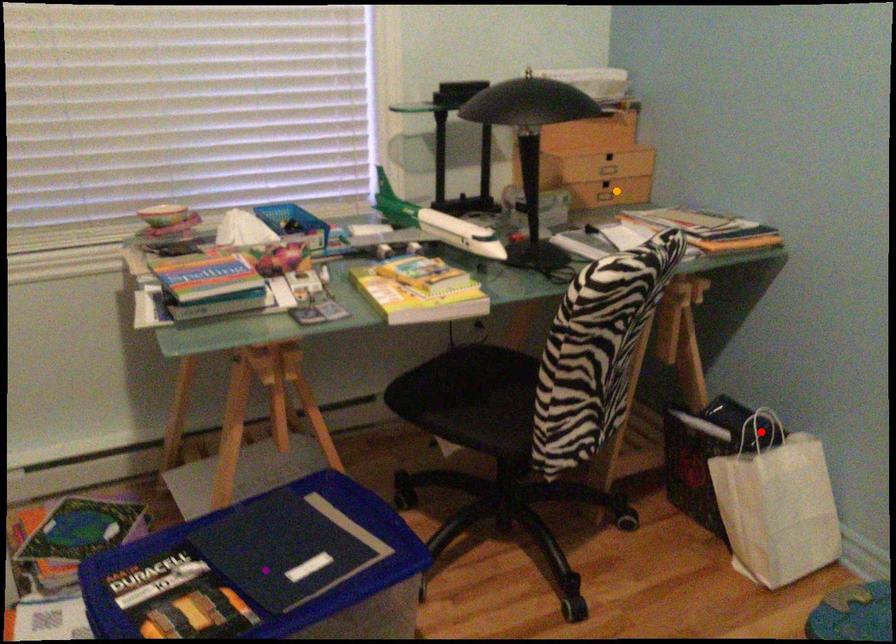
Order these from nearest to farthest:
A) orange point
B) red point
C) purple point

purple point → red point → orange point